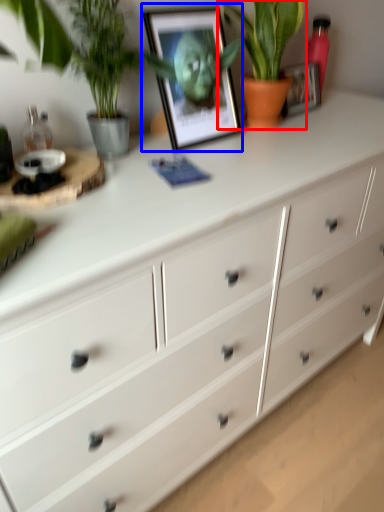
Question: Which of the following is the closest to the observer, houseplant (highlighted by a red box) or picture frame (highlighted by a blue box)?

Choices:
 (A) houseplant
 (B) picture frame

Answer: (B)